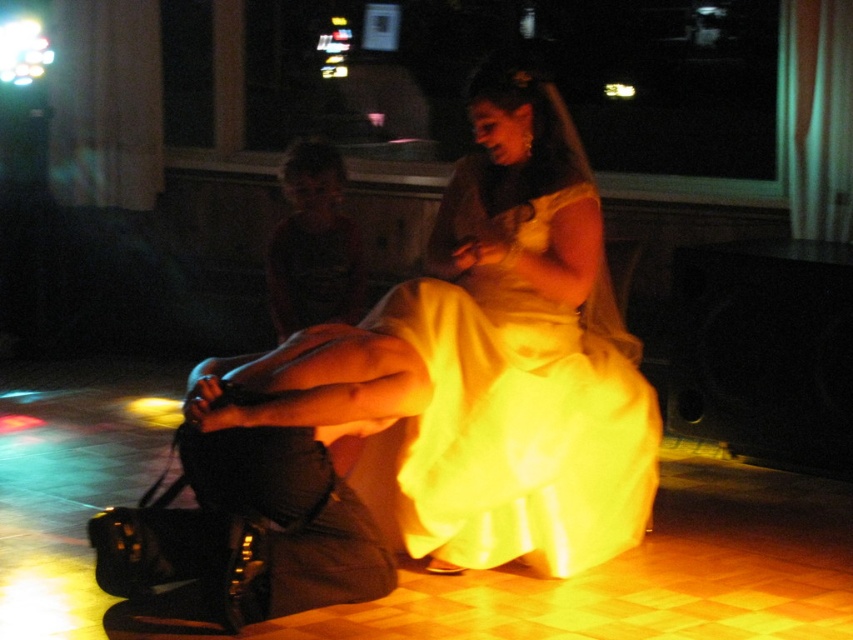
You are a photographer setting up for an event in the dance hall. You need to place a small tripod between the silky yellow dress at center and the black leather purse at lower left. Which object should you position the tripod closer to if you want it to be near the larger item?

The silky yellow dress at center is larger than the black leather purse at lower left, so you should position the tripod closer to the silky yellow dress at center.

You are a photographer setting up a shoot in the dance hall. You need to place a small tripod between the silky yellow dress at center and the black leather purse at lower left. Considering their sizes, will the space between them accommodate the tripod?

The silky yellow dress at center is wider than the black leather purse at lower left. Since the dress is larger in width, there might be sufficient space between them to place the tripod, but the exact distance isn

You are a photographer standing at the camera position. You want to take a closeup shot of the silky yellow dress at center. Can you step forward to get closer without moving the dress?

The silky yellow dress at center is 3.07 meters from camera. Since you can move forward, you can step closer to reduce the distance and take the closeup shot.